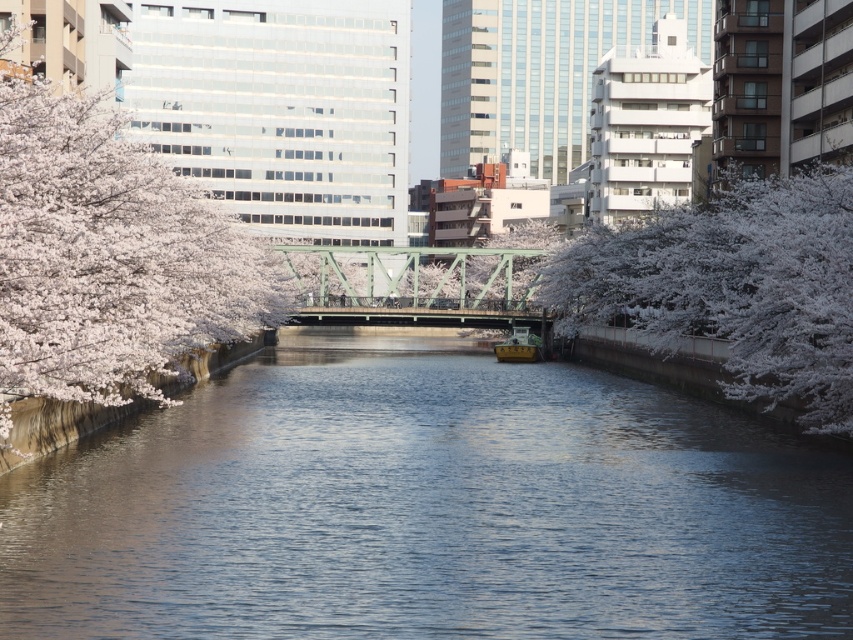
Question: Can you confirm if clear water at center is smaller than white blossoms at right?

Choices:
 (A) no
 (B) yes

Answer: (A)

Question: Is the position of white blossoms at left more distant than that of white blossoms at right?

Choices:
 (A) yes
 (B) no

Answer: (B)

Question: Among these objects, which one is nearest to the camera?

Choices:
 (A) clear water at center
 (B) gold polished wood boat at center
 (C) white blossoms at left

Answer: (A)

Question: Which point is closer to the camera?

Choices:
 (A) white blossoms at right
 (B) white blossoms at left
 (C) gold polished wood boat at center
 (D) clear water at center

Answer: (D)

Question: Which point is closer to the camera?

Choices:
 (A) clear water at center
 (B) white blossoms at right

Answer: (A)

Question: Can you confirm if clear water at center is bigger than white blossoms at left?

Choices:
 (A) no
 (B) yes

Answer: (B)